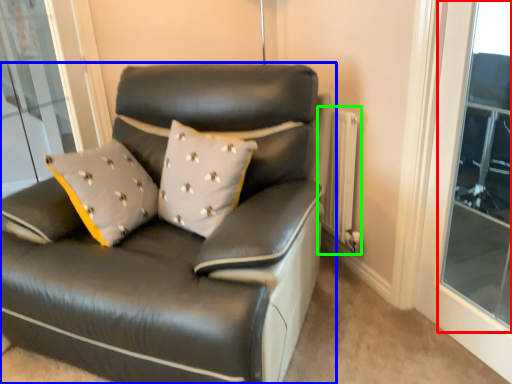
Question: Which object is positioned farthest from window (highlighted by a red box)? Select from studio couch (highlighted by a blue box) and radiator (highlighted by a green box).

Choices:
 (A) studio couch
 (B) radiator

Answer: (A)